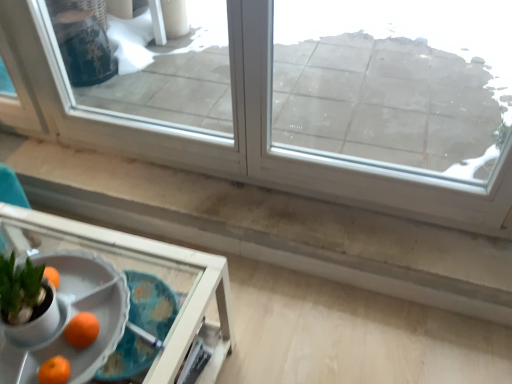
Identify the location of vacant location behind orange matte at lower left. The height and width of the screenshot is (384, 512). (89, 294).